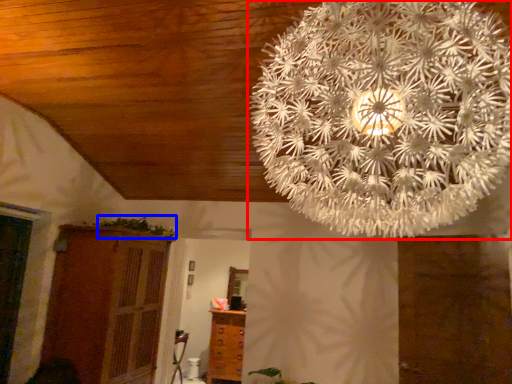
Question: Which object appears closest to the camera in this image, lamp (highlighted by a red box) or plant (highlighted by a blue box)?

Choices:
 (A) lamp
 (B) plant

Answer: (A)